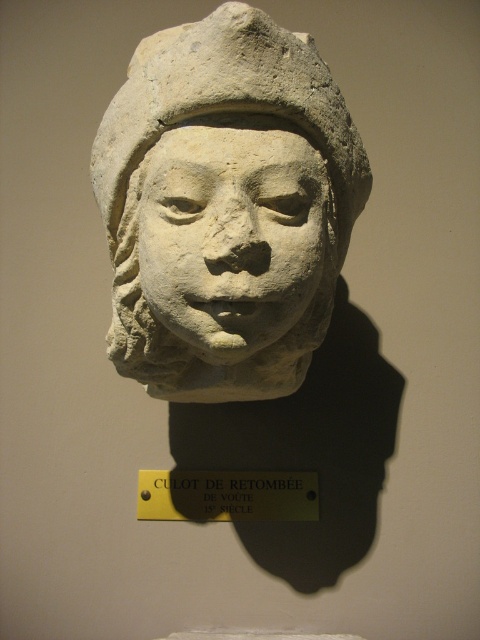
Is stone face at center positioned behind yellow metal sign at center?

No, it is in front of yellow metal sign at center.

From the picture: Can you confirm if stone face at center is positioned above yellow metal sign at center?

Correct, stone face at center is located above yellow metal sign at center.

Describe the element at coordinates (230, 236) in the screenshot. The image size is (480, 640). I see `stone face at center` at that location.

Where is `stone face at center`? Image resolution: width=480 pixels, height=640 pixels. stone face at center is located at coordinates (230, 236).

Is white stone bust at center to the right of yellow metal sign at center from the viewer's perspective?

Incorrect, white stone bust at center is not on the right side of yellow metal sign at center.

Between white stone bust at center and yellow metal sign at center, which one has less height?

With less height is yellow metal sign at center.

Does point (159, 346) come in front of point (268, 474)?

Yes, it is in front of point (268, 474).

Where is `white stone bust at center`? white stone bust at center is located at coordinates (226, 208).

Is point (123, 339) positioned behind point (311, 189)?

Yes, it is behind point (311, 189).

Who is more forward, (126, 154) or (291, 196)?

Point (291, 196) is in front.

At what (x,y) coordinates should I click in order to perform the action: click on white stone bust at center. Please return your answer as a coordinate pair (x, y). Looking at the image, I should click on (226, 208).